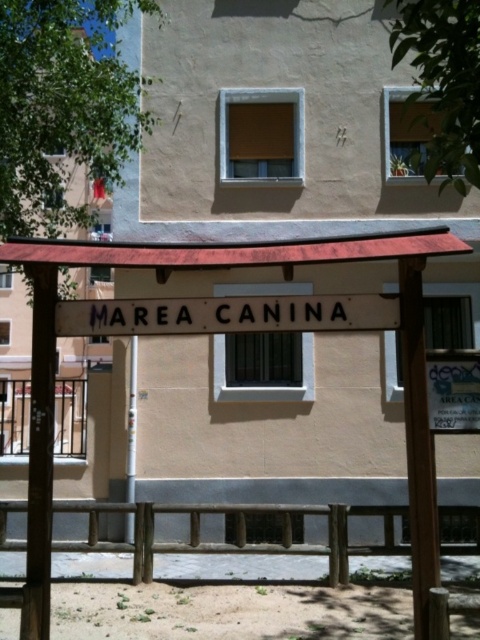
Is wooden fence at lower center taller than white painted wood sign at center?

Yes, wooden fence at lower center is taller than white painted wood sign at center.

Is point (239, 516) more distant than point (72, 332)?

That is True.

Where is `wooden fence at lower center`? This screenshot has height=640, width=480. wooden fence at lower center is located at coordinates (237, 532).

Can you confirm if wooden fence at lower center is positioned below white plastic pole at center?

Yes.

Which is more to the left, wooden fence at lower center or white plastic pole at center?

white plastic pole at center

Between point (94, 532) and point (132, 349), which one is positioned behind?

The point (132, 349) is more distant.

You are a GUI agent. You are given a task and a screenshot of the screen. Output one action in this format:
    pyautogui.click(x=<x>, y=<y>)
    Task: Click on the wooden fence at lower center
    The image size is (480, 640).
    Given the screenshot: What is the action you would take?
    pyautogui.click(x=237, y=532)

Image resolution: width=480 pixels, height=640 pixels. What do you see at coordinates (227, 314) in the screenshot?
I see `white painted wood sign at center` at bounding box center [227, 314].

Based on the photo, is white painted wood sign at center positioned at the back of white paper sign at lower right?

Yes.

Locate an element on the screen. white painted wood sign at center is located at coordinates (227, 314).